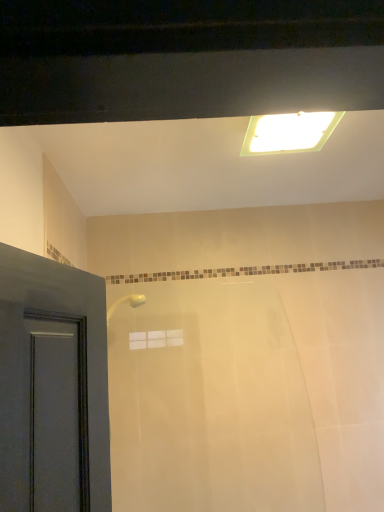
At what (x,y) coordinates should I click in order to perform the action: click on white fluorescent light at upper center. Please return your answer as a coordinate pair (x, y). This screenshot has width=384, height=512. Looking at the image, I should click on (289, 132).

Describe the element at coordinates (289, 132) in the screenshot. I see `white fluorescent light at upper center` at that location.

What is the approximate height of translucent plastic bathtub at center?

It is 34.35 inches.

What do you see at coordinates (240, 394) in the screenshot?
I see `translucent plastic bathtub at center` at bounding box center [240, 394].

Where is `translucent plastic bathtub at center`? The image size is (384, 512). translucent plastic bathtub at center is located at coordinates (240, 394).

In order to face translucent plastic bathtub at center, should I rotate leftwards or rightwards?

Rotate your view right by about 3.062°.

The height and width of the screenshot is (512, 384). I want to click on white fluorescent light at upper center, so click(x=289, y=132).

Consider the image. Is white fluorescent light at upper center to the right of translucent plastic bathtub at center from the viewer's perspective?

Indeed, white fluorescent light at upper center is positioned on the right side of translucent plastic bathtub at center.

Which object is further away from the camera taking this photo, white fluorescent light at upper center or translucent plastic bathtub at center?

translucent plastic bathtub at center is further away from the camera.

Is point (303, 127) behind point (225, 423)?

No, (303, 127) is in front of (225, 423).

From the image's perspective, is white fluorescent light at upper center positioned above or below translucent plastic bathtub at center?

Clearly, from the image's perspective, white fluorescent light at upper center is above translucent plastic bathtub at center.

From a real-world perspective, between white fluorescent light at upper center and translucent plastic bathtub at center, who is vertically higher?

In real-world perspective, white fluorescent light at upper center is above.

Between white fluorescent light at upper center and translucent plastic bathtub at center, which one has smaller width?

Thinner between the two is translucent plastic bathtub at center.

Considering the sizes of objects white fluorescent light at upper center and translucent plastic bathtub at center in the image provided, who is taller, white fluorescent light at upper center or translucent plastic bathtub at center?

Standing taller between the two is translucent plastic bathtub at center.

Considering the sizes of white fluorescent light at upper center and translucent plastic bathtub at center in the image, is white fluorescent light at upper center bigger or smaller than translucent plastic bathtub at center?

Considering their sizes, white fluorescent light at upper center takes up less space than translucent plastic bathtub at center.

Would you say white fluorescent light at upper center is outside translucent plastic bathtub at center?

white fluorescent light at upper center is positioned outside translucent plastic bathtub at center.

Is white fluorescent light at upper center not near translucent plastic bathtub at center?

Absolutely, white fluorescent light at upper center is distant from translucent plastic bathtub at center.

Is translucent plastic bathtub at center at the back of white fluorescent light at upper center?

white fluorescent light at upper center is not turned away from translucent plastic bathtub at center.

In the image, there is a white fluorescent light at upper center. At what (x,y) coordinates should I click in order to perform the action: click on bath below it (from a real-world perspective). Please return your answer as a coordinate pair (x, y). Looking at the image, I should click on (240, 394).

Is translucent plastic bathtub at center to the left of white fluorescent light at upper center from the viewer's perspective?

Correct, you'll find translucent plastic bathtub at center to the left of white fluorescent light at upper center.

Is translucent plastic bathtub at center further to the viewer compared to white fluorescent light at upper center?

Yes, translucent plastic bathtub at center is further from the camera.

Which is farther, (x=262, y=504) or (x=308, y=150)?

Point (x=262, y=504)

From the image's perspective, which object appears higher, translucent plastic bathtub at center or white fluorescent light at upper center?

white fluorescent light at upper center, from the image's perspective.

From a real-world perspective, is translucent plastic bathtub at center on top of white fluorescent light at upper center?

Actually, translucent plastic bathtub at center is physically below white fluorescent light at upper center in the real world.

Considering the sizes of objects translucent plastic bathtub at center and white fluorescent light at upper center in the image provided, who is thinner, translucent plastic bathtub at center or white fluorescent light at upper center?

translucent plastic bathtub at center.

Which of these two, translucent plastic bathtub at center or white fluorescent light at upper center, stands shorter?

With less height is white fluorescent light at upper center.

Based on their sizes in the image, would you say translucent plastic bathtub at center is bigger or smaller than white fluorescent light at upper center?

Considering their sizes, translucent plastic bathtub at center takes up more space than white fluorescent light at upper center.

Would you say translucent plastic bathtub at center is inside or outside white fluorescent light at upper center?

translucent plastic bathtub at center is located beyond the bounds of white fluorescent light at upper center.

Are translucent plastic bathtub at center and white fluorescent light at upper center far apart?

Indeed, translucent plastic bathtub at center is not near white fluorescent light at upper center.

Is translucent plastic bathtub at center oriented away from white fluorescent light at upper center?

No, translucent plastic bathtub at center's orientation is not away from white fluorescent light at upper center.

Can you tell me how much translucent plastic bathtub at center and white fluorescent light at upper center differ in facing direction?

The angular difference between translucent plastic bathtub at center and white fluorescent light at upper center is 4.51 degrees.

How far apart are translucent plastic bathtub at center and white fluorescent light at upper center?

translucent plastic bathtub at center is 3.55 feet from white fluorescent light at upper center.

You are a GUI agent. You are given a task and a screenshot of the screen. Output one action in this format:
    pyautogui.click(x=<x>, y=<y>)
    Task: Click on the bath that is below the white fluorescent light at upper center (from the image's perspective)
    This screenshot has height=512, width=384.
    Given the screenshot: What is the action you would take?
    pyautogui.click(x=240, y=394)

At what (x,y) coordinates should I click in order to perform the action: click on lighting above the translucent plastic bathtub at center (from a real-world perspective). Please return your answer as a coordinate pair (x, y). Looking at the image, I should click on (289, 132).

You are a GUI agent. You are given a task and a screenshot of the screen. Output one action in this format:
    pyautogui.click(x=<x>, y=<y>)
    Task: Click on the lighting lying on the right of translucent plastic bathtub at center
    
    Given the screenshot: What is the action you would take?
    pyautogui.click(x=289, y=132)